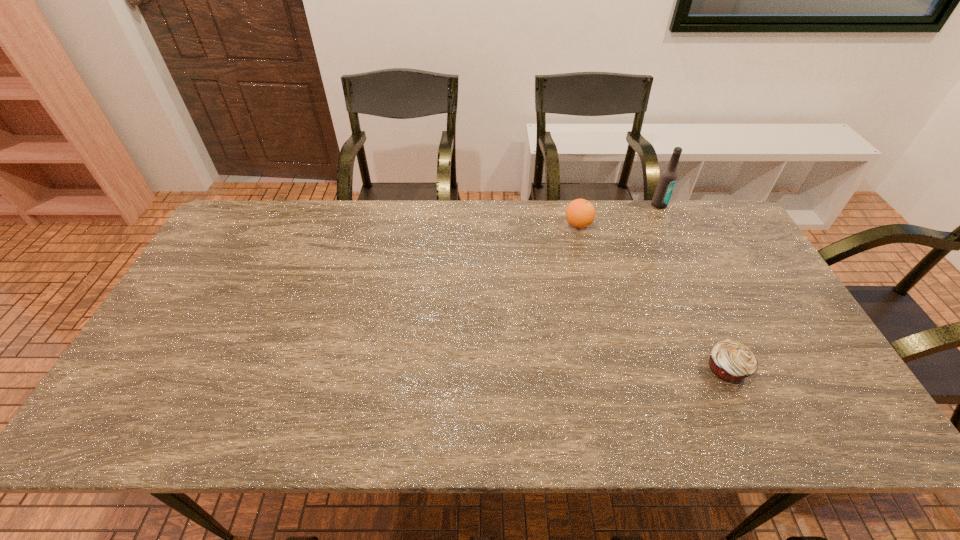
This screenshot has width=960, height=540. I want to click on free spot between the leftmost object and the nearest object, so click(653, 296).

I want to click on free space between the farthest object and the nearest object, so click(693, 287).

Locate an element on the screen. This screenshot has height=540, width=960. vacant area that lies between the muffin and the tallest object is located at coordinates (693, 287).

Find the location of a particular element. The image size is (960, 540). vacant region between the muffin and the orange is located at coordinates (653, 296).

Where is `free space between the tallest object and the nearest object`? Image resolution: width=960 pixels, height=540 pixels. free space between the tallest object and the nearest object is located at coordinates click(693, 287).

Where is `unoccupied area between the leftmost object and the muffin`? The image size is (960, 540). unoccupied area between the leftmost object and the muffin is located at coordinates (653, 296).

At what (x,y) coordinates should I click in order to perform the action: click on object that is the closest to the farthest object. Please return your answer as a coordinate pair (x, y). The image size is (960, 540). Looking at the image, I should click on (580, 213).

Choose which object is the second nearest neighbor to the nearest object. Please provide its 2D coordinates. Your answer should be formatted as a tuple, i.e. [(x, y)], where the tuple contains the x and y coordinates of a point satisfying the conditions above.

[(667, 180)]

Where is `vacant space that satisfies the following two spatial constraints: 1. on the front side of the leftmost object; 2. on the right side of the muffin`? This screenshot has height=540, width=960. vacant space that satisfies the following two spatial constraints: 1. on the front side of the leftmost object; 2. on the right side of the muffin is located at coordinates (613, 369).

I want to click on vacant space that satisfies the following two spatial constraints: 1. on the front side of the second nearest object; 2. on the left side of the muffin, so click(613, 369).